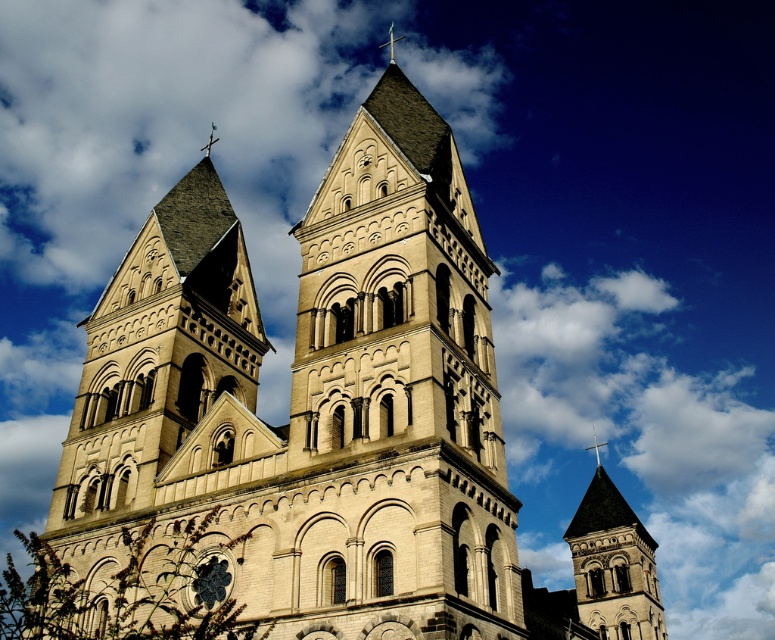
Does smooth silver cross at upper center come behind polished silver cross at upper center?

Yes, it is behind polished silver cross at upper center.

Who is positioned more to the left, smooth silver cross at upper center or polished silver cross at upper center?

smooth silver cross at upper center

Which is behind, point (391, 56) or point (600, 444)?

Point (391, 56)

This screenshot has width=775, height=640. I want to click on smooth silver cross at upper center, so click(391, 42).

Based on the photo, who is taller, beige stone tower at center or smooth silver cross at upper center?

With more height is beige stone tower at center.

Between point (85, 353) and point (381, 45), which one is positioned behind?

The point (381, 45) is more distant.

This screenshot has width=775, height=640. I want to click on beige stone tower at center, so click(x=160, y=349).

Does smooth gray stone tower at center have a greater width compared to polished silver cross at upper center?

Indeed, smooth gray stone tower at center has a greater width compared to polished silver cross at upper center.

Can you confirm if smooth gray stone tower at center is smaller than polished silver cross at upper center?

Actually, smooth gray stone tower at center might be larger than polished silver cross at upper center.

Image resolution: width=775 pixels, height=640 pixels. In order to click on smooth gray stone tower at center in this screenshot , I will do `click(612, 564)`.